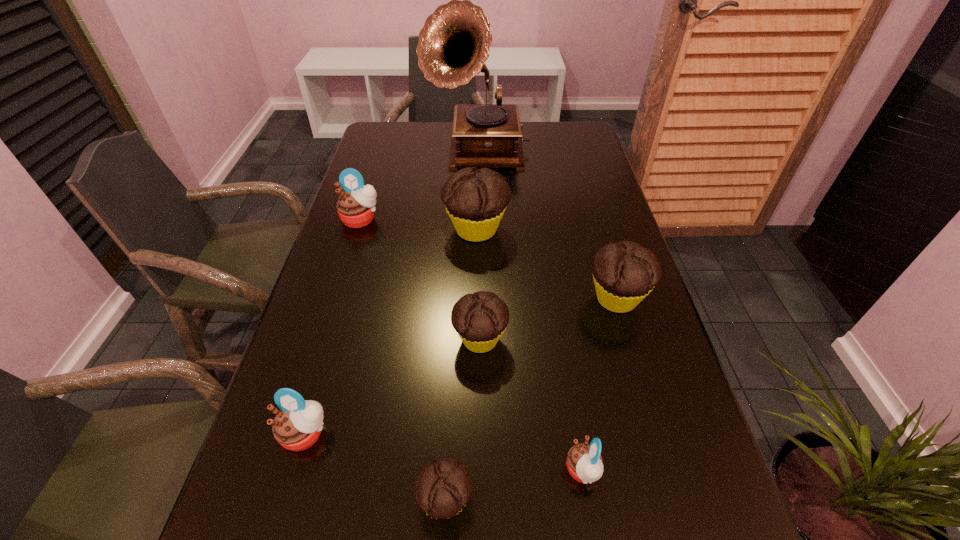
Where is `free space located on the back of the nearest chocolate muffin`? The width and height of the screenshot is (960, 540). free space located on the back of the nearest chocolate muffin is located at coordinates (455, 317).

Locate an element on the screen. The width and height of the screenshot is (960, 540). object at the far edge is located at coordinates (454, 43).

You are a GUI agent. You are given a task and a screenshot of the screen. Output one action in this format:
    pyautogui.click(x=<x>, y=<y>)
    Task: Click on the object that is at the right edge
    Image resolution: width=960 pixels, height=540 pixels.
    Given the screenshot: What is the action you would take?
    pyautogui.click(x=624, y=273)

I want to click on vacant area at the far edge, so click(x=535, y=138).

This screenshot has width=960, height=540. In the image, there is a desktop. Find the location of `vacant space at the left edge`. vacant space at the left edge is located at coordinates (275, 518).

Identify the location of vacant region at the right edge of the desktop. (586, 160).

Identify the location of blank space at the far left corner. (397, 143).

This screenshot has width=960, height=540. I want to click on vacant area that lies between the rightmost muffin and the second smallest chocolate muffin, so click(x=548, y=319).

Where is `empty location between the rightmost pink muffin and the farthest chocolate muffin`? empty location between the rightmost pink muffin and the farthest chocolate muffin is located at coordinates (529, 350).

Locate an element on the screen. Image resolution: width=960 pixels, height=540 pixels. vacant area that lies between the smallest chocolate muffin and the third biggest chocolate muffin is located at coordinates (463, 420).